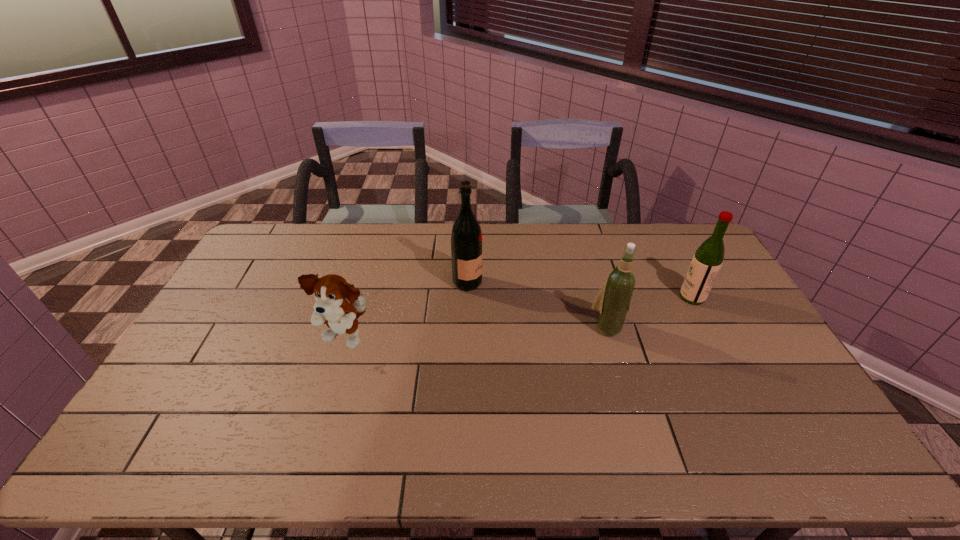
Locate an element on the screen. The width and height of the screenshot is (960, 540). the left liquor is located at coordinates (466, 238).

Where is `the tallest object`? This screenshot has height=540, width=960. the tallest object is located at coordinates (466, 238).

Find the location of `the shorter liquor`. the shorter liquor is located at coordinates (708, 258).

I want to click on the right liquor, so click(x=708, y=258).

This screenshot has width=960, height=540. I want to click on wine bottle, so click(x=613, y=300).

The image size is (960, 540). I want to click on puppy, so click(332, 292).

The height and width of the screenshot is (540, 960). Find the location of `the leftmost object`. the leftmost object is located at coordinates (332, 292).

Where is `free point located 0.230m on the front-facing side of the left liquor`? Image resolution: width=960 pixels, height=540 pixels. free point located 0.230m on the front-facing side of the left liquor is located at coordinates (549, 282).

Find the location of a particular element. This screenshot has height=540, width=960. free location located on the label of the shorter liquor is located at coordinates (661, 297).

Image resolution: width=960 pixels, height=540 pixels. I want to click on free region located on the label of the shorter liquor, so pos(588,297).